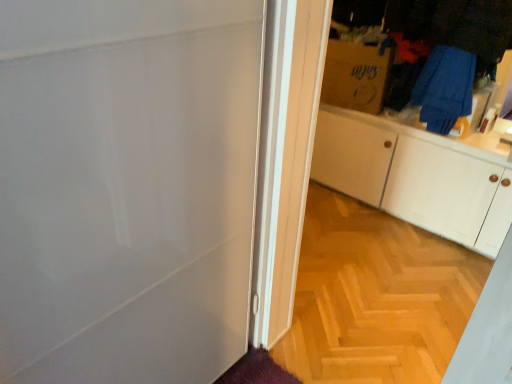
Question: Considering the relative sizes of wooden floor at center and blue fabric at upper right, which is counted as the 1th laundry, starting from the top, in the image provided, is wooden floor at center taller than blue fabric at upper right, which is counted as the 1th laundry, starting from the top,?

Choices:
 (A) no
 (B) yes

Answer: (A)

Question: Considering the relative positions of wooden floor at center and blue fabric at upper right, which is the 2th laundry from bottom to top, in the image provided, is wooden floor at center behind blue fabric at upper right, which is the 2th laundry from bottom to top,?

Choices:
 (A) yes
 (B) no

Answer: (B)

Question: Considering the relative sizes of wooden floor at center and blue fabric at upper right, which is counted as the 1th laundry, starting from the top, in the image provided, is wooden floor at center thinner than blue fabric at upper right, which is counted as the 1th laundry, starting from the top,?

Choices:
 (A) no
 (B) yes

Answer: (A)

Question: Is wooden floor at center wider than blue fabric at upper right, which is the 2th laundry from bottom to top?

Choices:
 (A) no
 (B) yes

Answer: (B)

Question: Is blue fabric at upper right, which is counted as the 1th laundry, starting from the top, located within wooden floor at center?

Choices:
 (A) no
 (B) yes

Answer: (A)

Question: Considering the positions of blue fabric laundry at upper right, the second laundry positioned from the top, and white matte cabinet at right in the image, is blue fabric laundry at upper right, the second laundry positioned from the top, taller or shorter than white matte cabinet at right?

Choices:
 (A) tall
 (B) short

Answer: (B)

Question: From a real-world perspective, relative to white matte cabinet at right, is blue fabric laundry at upper right, the first laundry in the bottom-to-top sequence, vertically above or below?

Choices:
 (A) above
 (B) below

Answer: (A)

Question: Does point (431, 59) appear closer or farther from the camera than point (460, 218)?

Choices:
 (A) farther
 (B) closer

Answer: (B)

Question: Considering the relative positions of blue fabric laundry at upper right, the first laundry in the bottom-to-top sequence, and white matte cabinet at right in the image provided, is blue fabric laundry at upper right, the first laundry in the bottom-to-top sequence, to the left or to the right of white matte cabinet at right?

Choices:
 (A) left
 (B) right

Answer: (B)

Question: Based on their sizes in the image, would you say brown cardboard box at upper right is bigger or smaller than blue fabric at upper right, which is counted as the 1th laundry, starting from the top?

Choices:
 (A) big
 (B) small

Answer: (B)

Question: Is point (386, 72) positioned closer to the camera than point (453, 3)?

Choices:
 (A) farther
 (B) closer

Answer: (A)

Question: From the image's perspective, is brown cardboard box at upper right located above or below blue fabric at upper right, which is counted as the 1th laundry, starting from the top?

Choices:
 (A) below
 (B) above

Answer: (B)

Question: Based on their positions, is brown cardboard box at upper right located to the left or right of blue fabric at upper right, which is the 2th laundry from bottom to top?

Choices:
 (A) right
 (B) left

Answer: (B)

Question: Is wooden floor at center spatially inside blue fabric at upper right, which is the 2th laundry from bottom to top, or outside of it?

Choices:
 (A) inside
 (B) outside

Answer: (B)

Question: Based on their positions, is wooden floor at center located to the left or right of blue fabric at upper right, which is the 2th laundry from bottom to top?

Choices:
 (A) left
 (B) right

Answer: (A)